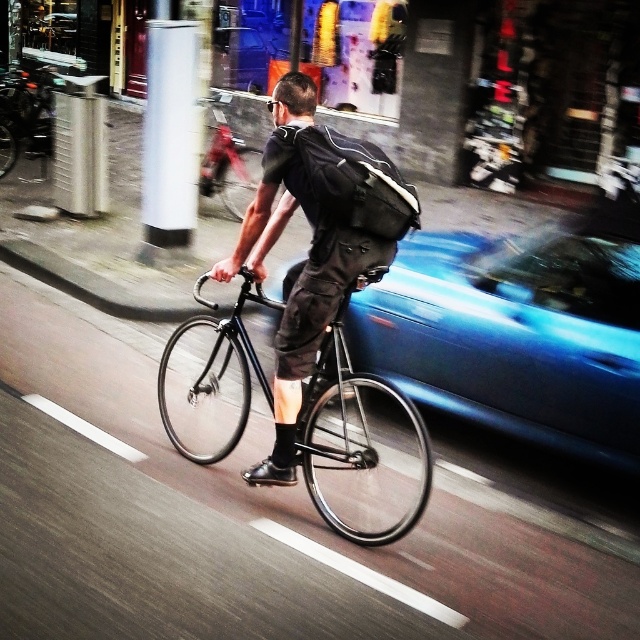
Question: Is blue metallic car at center to the right of white glossy pillar at upper left from the viewer's perspective?

Choices:
 (A) yes
 (B) no

Answer: (A)

Question: Is blue metallic car at center to the left of black matte bicycle at center from the viewer's perspective?

Choices:
 (A) no
 (B) yes

Answer: (A)

Question: Which point is farther to the camera?

Choices:
 (A) blue metallic car at center
 (B) shiny black bicycle at center

Answer: (A)

Question: Which is farther from the black matte bicycle at center?

Choices:
 (A) white glossy pillar at upper left
 (B) blue metallic car at center
 (C) shiny black bicycle at center
 (D) matte black backpack at center

Answer: (C)

Question: Is matte black backpack at center bigger than black matte bicycle at center?

Choices:
 (A) no
 (B) yes

Answer: (A)

Question: Which point appears closest to the camera in this image?

Choices:
 (A) (308, 282)
 (B) (250, 193)

Answer: (A)